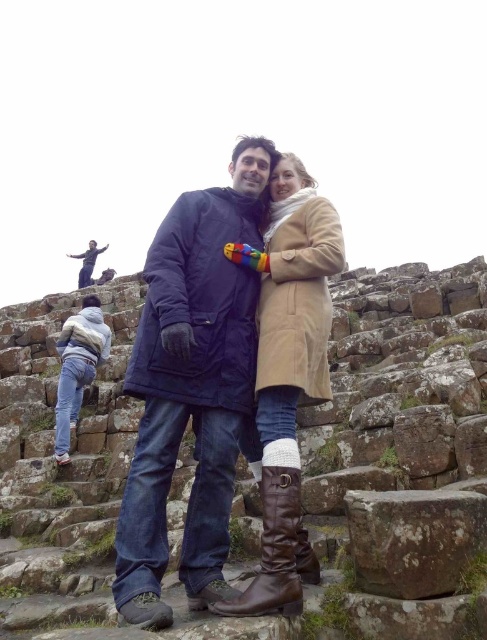
Is dark blue woolen coat at center further to the viewer compared to rusty stone at center?

No, dark blue woolen coat at center is in front of rusty stone at center.

Which is in front, point (258, 188) or point (353, 544)?

Point (353, 544) is in front.

In the scene shown: Who is more forward, [247,397] or [387,492]?

Point [247,397]

Where is `dark blue woolen coat at center`? Image resolution: width=487 pixels, height=640 pixels. dark blue woolen coat at center is located at coordinates (190, 387).

Between point (368, 496) and point (268, 481), which one is positioned in front?

Point (268, 481) is more forward.

Is point (435, 515) farther from viewer compared to point (288, 518)?

No, it is not.

The image size is (487, 640). Identify the location of rusty stone at center. (413, 540).

Is rusty stone at center wider than brown leather boot at lower center?

Indeed, rusty stone at center has a greater width compared to brown leather boot at lower center.

Is rusty stone at center positioned before brown leather boot at lower center?

No.

Image resolution: width=487 pixels, height=640 pixels. Find the location of `rusty stone at center`. rusty stone at center is located at coordinates (413, 540).